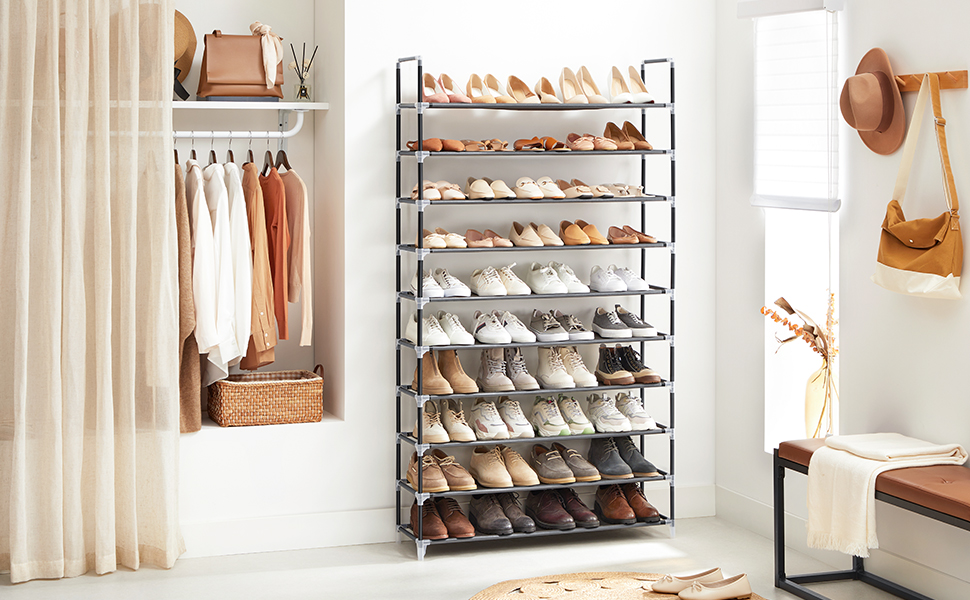
The image size is (970, 600). What are the coordinates of `metal hook` in the screenshot? It's located at (279, 133), (267, 137), (247, 137), (227, 138), (213, 140), (195, 141), (176, 142).